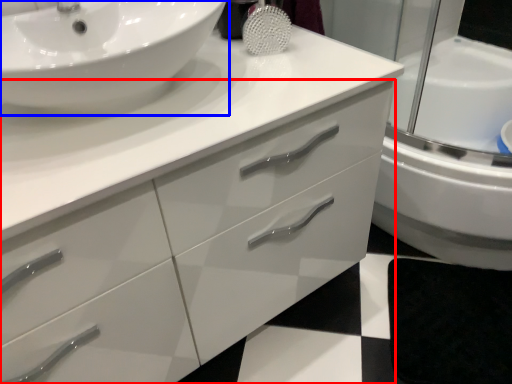
Question: Which of the following is the farthest to the observer, bathroom cabinet (highlighted by a red box) or sink (highlighted by a blue box)?

Choices:
 (A) bathroom cabinet
 (B) sink

Answer: (B)